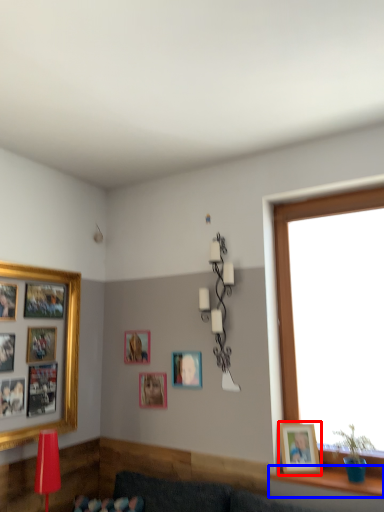
Question: Which object is further to the camera taking this photo, picture frame (highlighted by a red box) or window sill (highlighted by a blue box)?

Choices:
 (A) picture frame
 (B) window sill

Answer: (A)